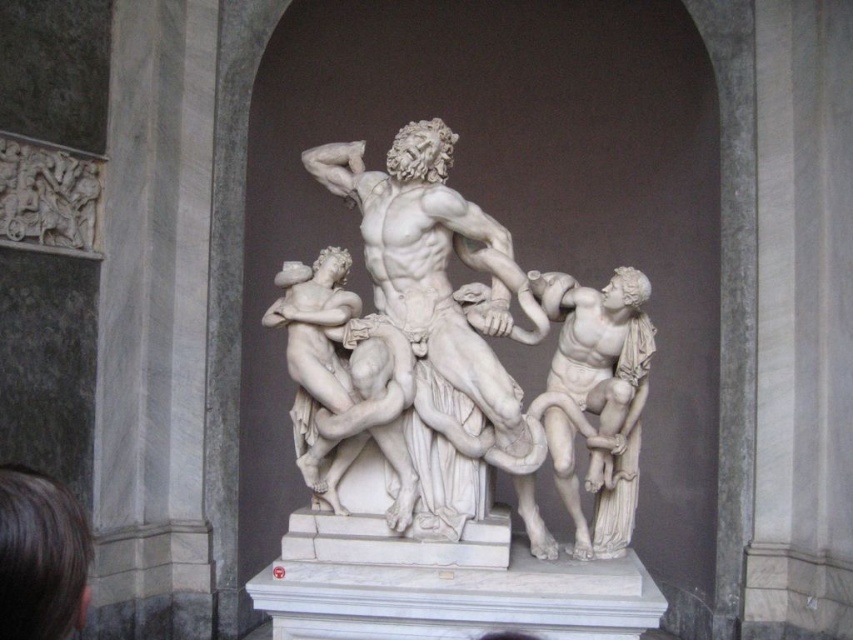
You are an art conservator assessing the placement of the white marble sculpture at center and the white marble statue at right. Based on their positions, which one is higher up in the alcove?

The white marble sculpture at center is above the white marble statue at right, so it is higher up in the alcove.

You are an art conservator examining the sculpture from the front. You notice two points of concern labeled as point (x=329, y=145) and point (x=590, y=477). Which point is closer to you?

Point (x=590, y=477) is closer to you because it is in front of point (x=329, y=145).

In the scene shown: You are an art curator planning to display the white marble sculpture at center and the white marble statue at right in a new exhibition. Given their sizes, which one should be placed in a larger display area to accommodate its dimensions?

The white marble sculpture at center should be placed in a larger display area because its width surpasses that of the white marble statue at right.